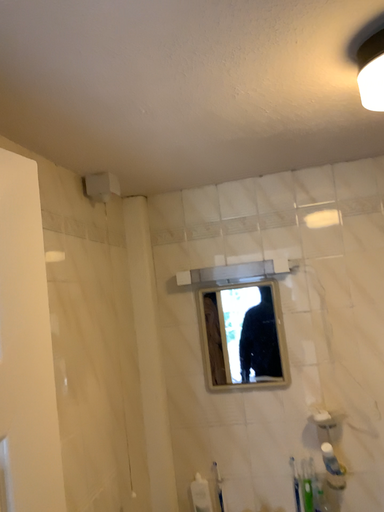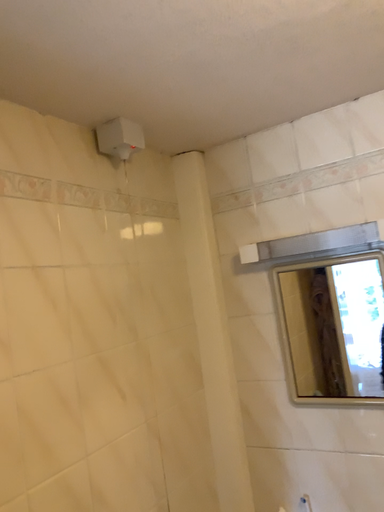
Question: Which way did the camera rotate in the video?

Choices:
 (A) rotated left
 (B) rotated right

Answer: (A)